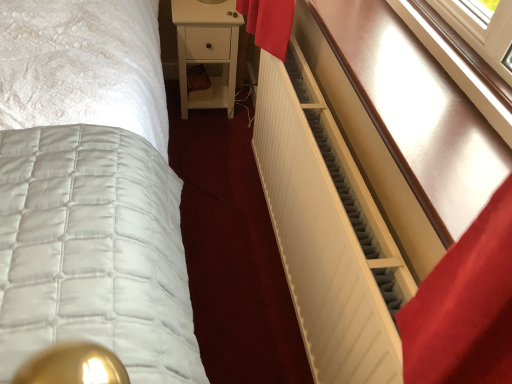
Question: Considering the positions of white quilted bed at center and white matte radiator at right in the image, is white quilted bed at center bigger or smaller than white matte radiator at right?

Choices:
 (A) big
 (B) small

Answer: (A)

Question: Considering the relative positions of white quilted bed at center and white matte radiator at right in the image provided, is white quilted bed at center to the left or to the right of white matte radiator at right?

Choices:
 (A) right
 (B) left

Answer: (B)

Question: Considering the real-world distances, which object is closest to the white matte radiator at right?

Choices:
 (A) white quilted bed at center
 (B) matte white radiator at right
 (C) white matte nightstand at center

Answer: (B)

Question: Estimate the real-world distances between objects in this image. Which object is farther from the matte white radiator at right?

Choices:
 (A) white matte radiator at right
 (B) white quilted bed at center
 (C) white matte nightstand at center

Answer: (C)